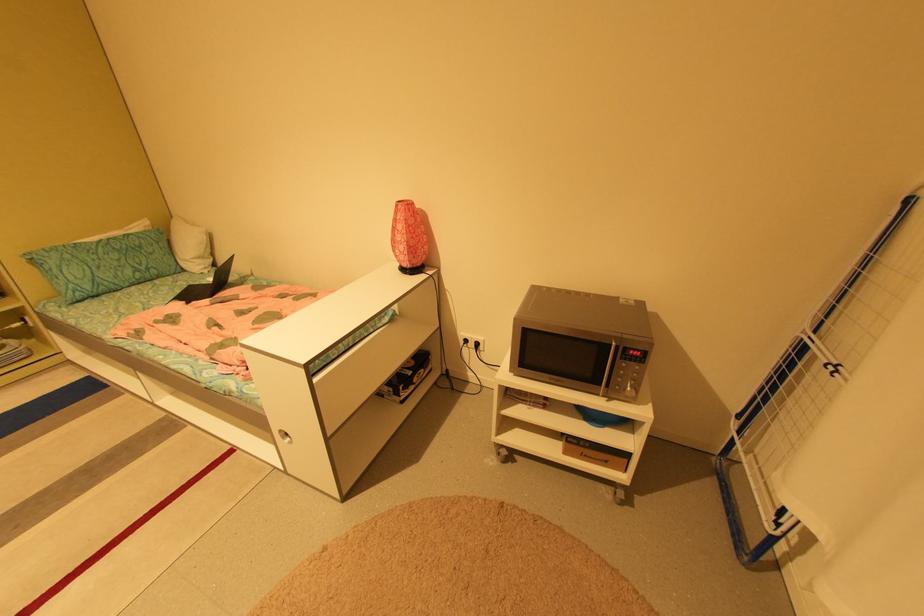
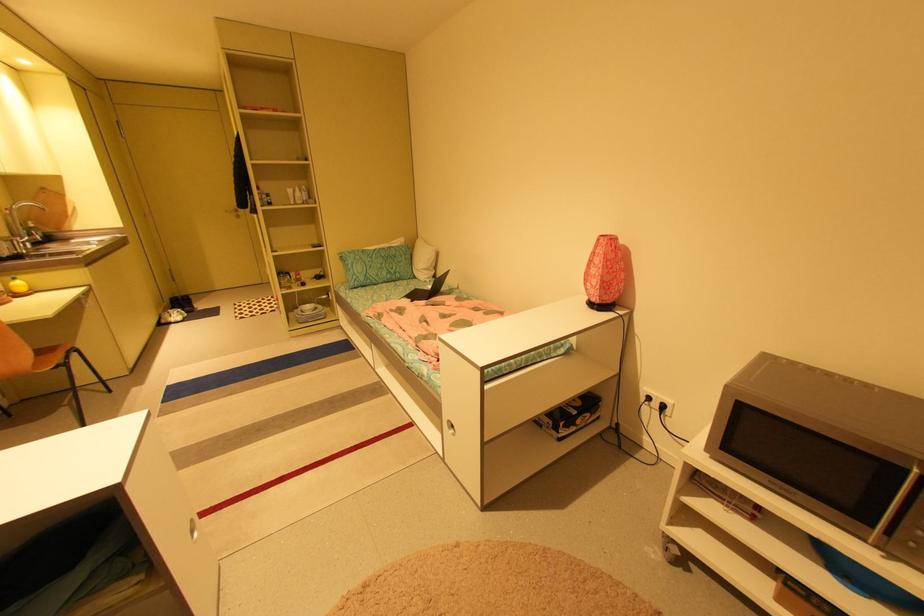
Question: The camera is either moving clockwise (left) or counter-clockwise (right) around the object. The first image is from the beginning of the video and the second image is from the end. Is the camera moving left or right when shooting the video?

Choices:
 (A) Left
 (B) Right

Answer: (B)